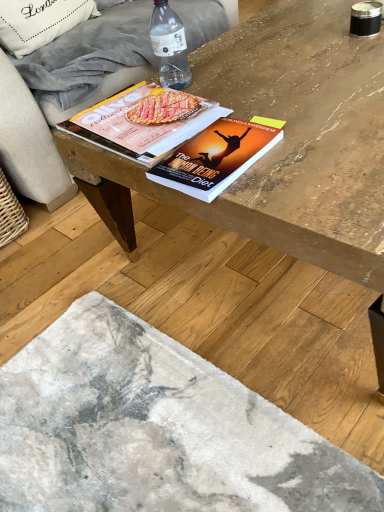
Identify the location of vacant space underneath matte paper magazine at center, which is the 2th book from front to back (from a real-world perspective). (139, 123).